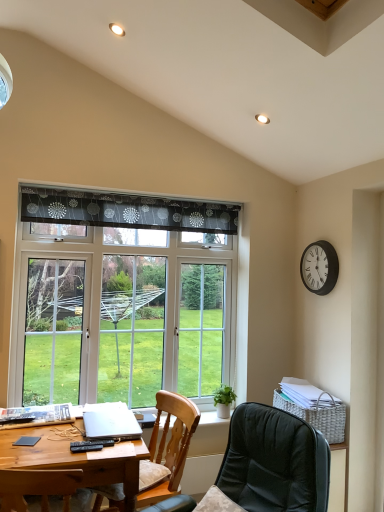
Locate an element on the screen. This screenshot has width=384, height=512. free space in front of silver metallic laptop at lower left is located at coordinates (82, 445).